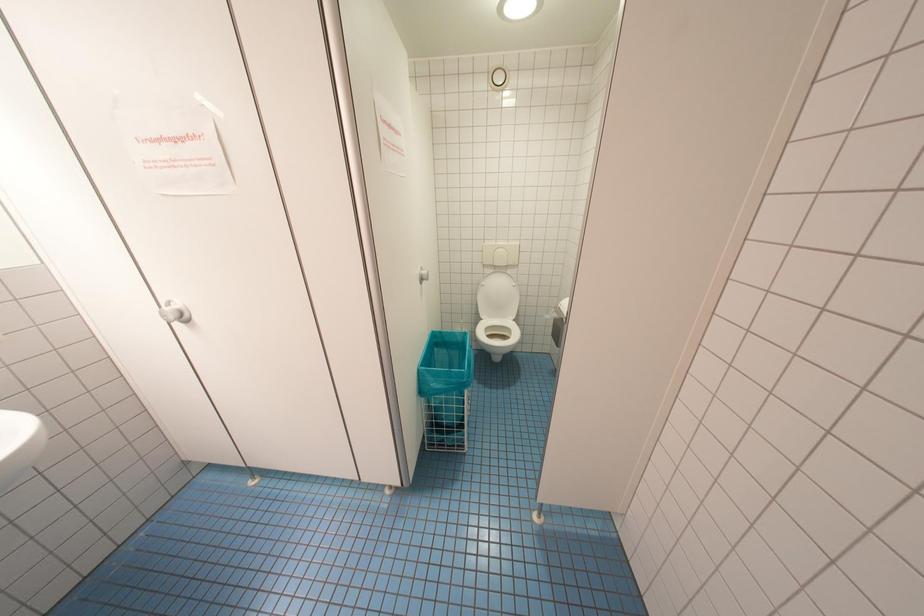
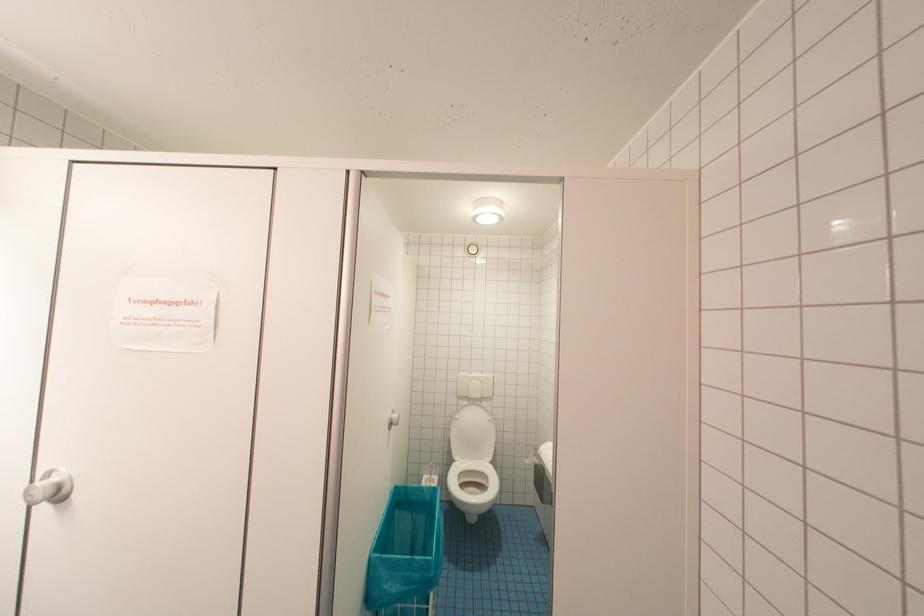
Question: The images are taken continuously from a first-person perspective. In which direction is your viewpoint rotating?

Choices:
 (A) Left
 (B) Right
 (C) Up
 (D) Down

Answer: (C)